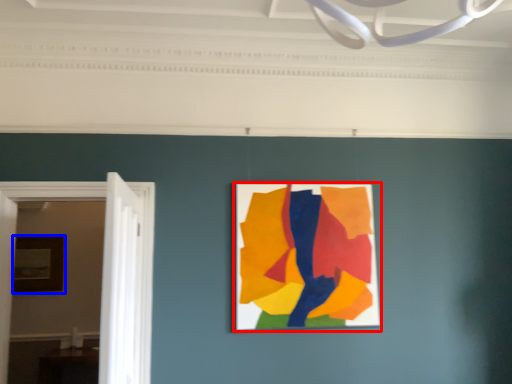
Question: Which of the following is the farthest to the observer, picture frame (highlighted by a red box) or picture frame (highlighted by a blue box)?

Choices:
 (A) picture frame
 (B) picture frame

Answer: (B)